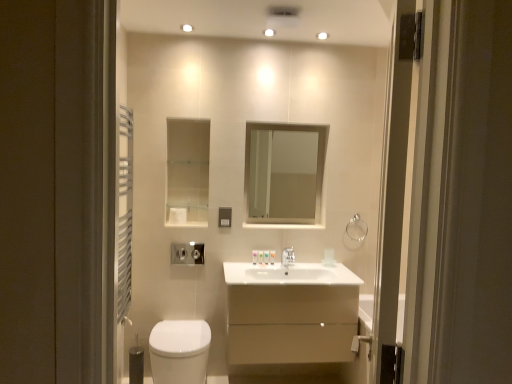
Where is `free space in front of white glossy toiletries at center, marked as the first toiletry in a right-to-left arrangement`? The height and width of the screenshot is (384, 512). free space in front of white glossy toiletries at center, marked as the first toiletry in a right-to-left arrangement is located at coordinates [x=267, y=266].